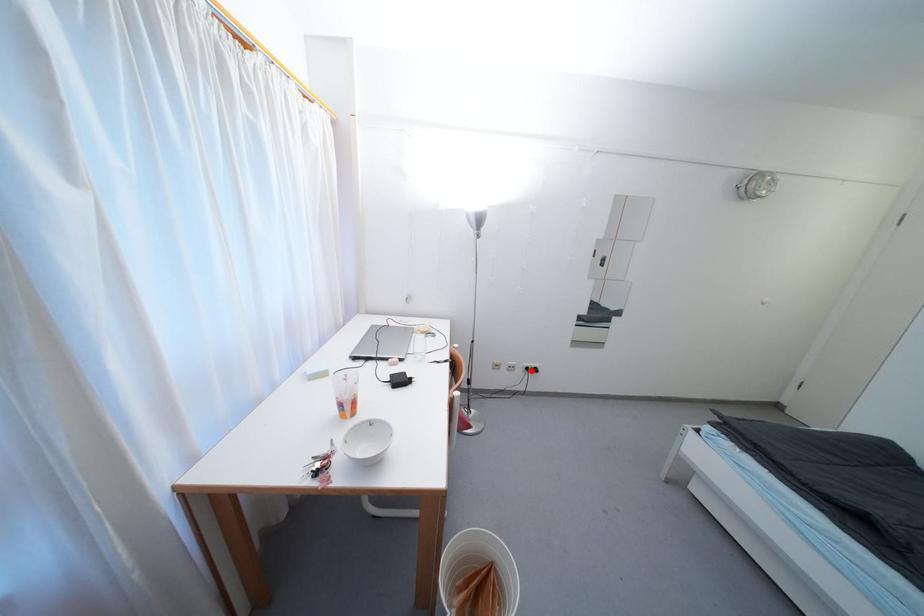
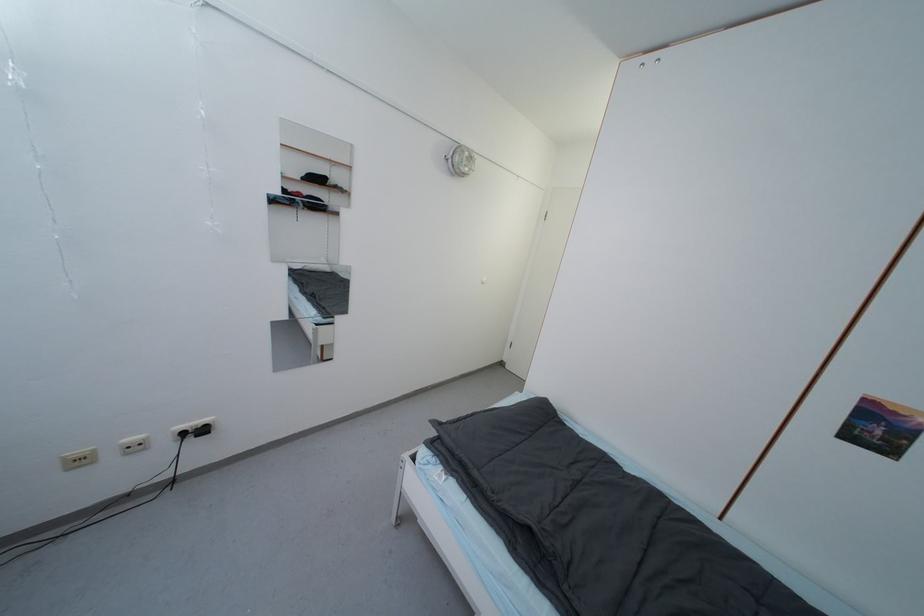
Locate, in the second image, the point that corresponds to the highlighted location in the first image.

(187, 436)